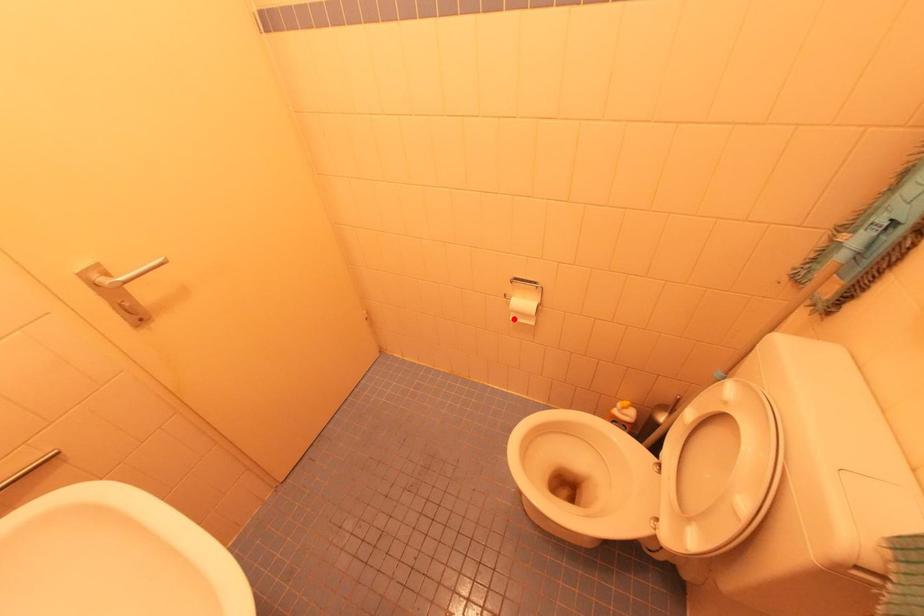
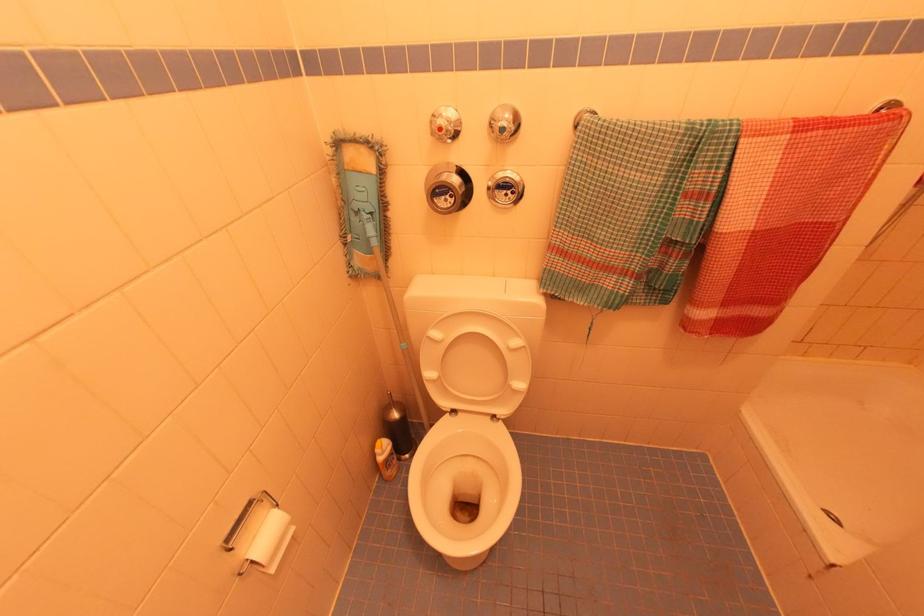
The point at the highlighted location is marked in the first image. Where is the corresponding point in the second image?

(274, 570)